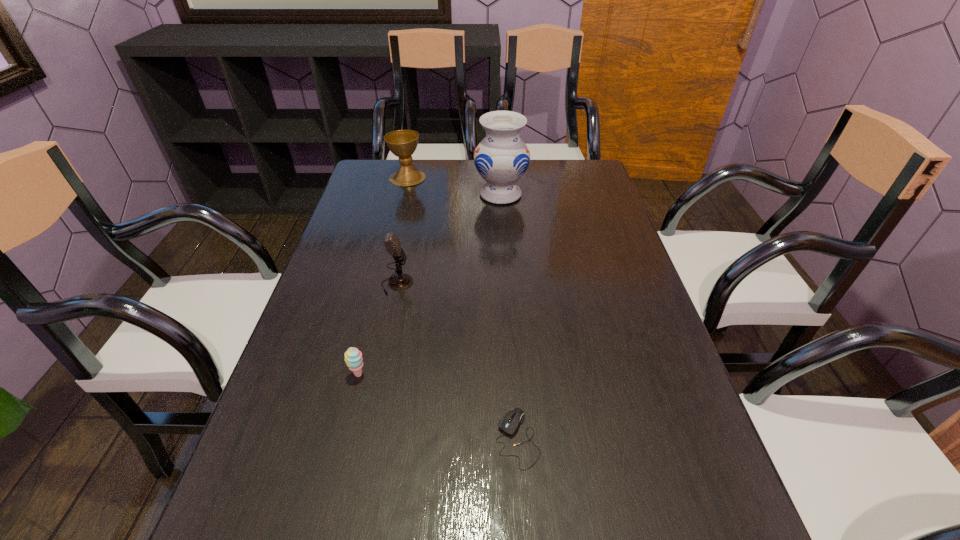
The image size is (960, 540). I want to click on free space at the right edge, so click(x=618, y=387).

In the image, there is a desktop. At what (x,y) coordinates should I click in order to perform the action: click on free region at the far left corner. Please return your answer as a coordinate pair (x, y). The width and height of the screenshot is (960, 540). Looking at the image, I should click on (370, 170).

Locate an element on the screen. The width and height of the screenshot is (960, 540). free spot at the far right corner of the desktop is located at coordinates click(559, 195).

This screenshot has width=960, height=540. I want to click on unoccupied area between the microphone and the shortest object, so click(x=457, y=361).

You are a GUI agent. You are given a task and a screenshot of the screen. Output one action in this format:
    pyautogui.click(x=<x>, y=<y>)
    Task: Click on the vacant space that is in between the third nearest object and the chalice
    The height and width of the screenshot is (540, 960).
    Given the screenshot: What is the action you would take?
    (402, 231)

Where is `free space between the shortest object and the vase`? This screenshot has width=960, height=540. free space between the shortest object and the vase is located at coordinates (509, 316).

Locate an element on the screen. Image resolution: width=960 pixels, height=540 pixels. blank region between the chalice and the computer mouse is located at coordinates (463, 308).

This screenshot has width=960, height=540. I want to click on blank region between the fourth farthest object and the vase, so click(x=429, y=284).

Find the location of a particular element. This screenshot has height=540, width=960. vacant region between the chalice and the third farthest object is located at coordinates (402, 231).

Locate an element on the screen. free spot between the chalice and the vase is located at coordinates (454, 186).